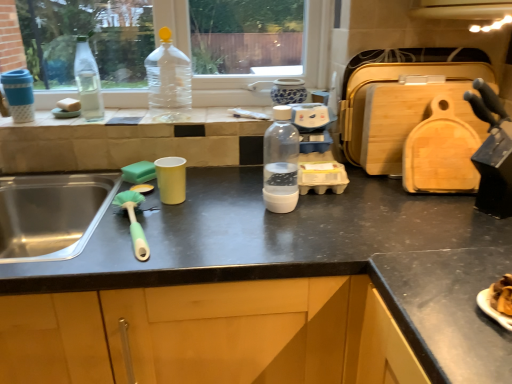
Identify the location of vacant area to the right of transparent plastic bottle at center, arranged as the third bottle when viewed from the back. (316, 209).